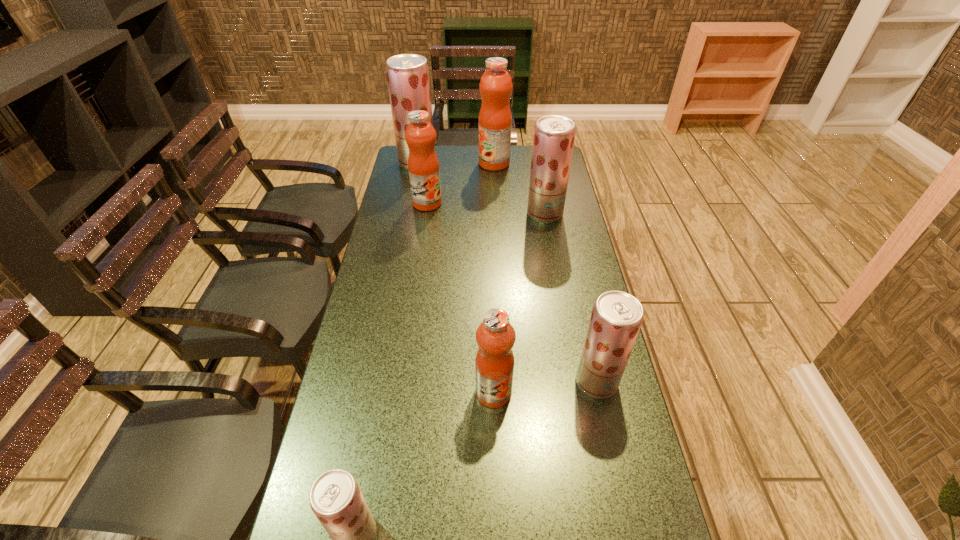
Choose which object is the second nearest neighbor to the second smallest strawberry fruit juice. Please provide its 2D coordinates. Your answer should be formatted as a tuple, i.e. [(x, y)], where the tuple contains the x and y coordinates of a point satisfying the conditions above.

[(335, 498)]

Find the location of a particular element. This screenshot has width=960, height=540. fruit juice that stands as the fourth closest to the biggest orange fruit juice is located at coordinates (616, 318).

Locate an element on the screen. The width and height of the screenshot is (960, 540). fruit juice that is the second closest to the smallest strawberry fruit juice is located at coordinates (616, 318).

Image resolution: width=960 pixels, height=540 pixels. What are the coordinates of `orange fruit juice that is the second nearest to the farthest orange fruit juice` in the screenshot? It's located at (495, 336).

The image size is (960, 540). Identify the location of orange fruit juice object that ranks as the closest to the leftmost orange fruit juice. (495, 119).

This screenshot has height=540, width=960. I want to click on strawberry fruit juice identified as the second closest to the biggest strawberry fruit juice, so click(x=616, y=318).

At what (x,y) coordinates should I click in order to perform the action: click on strawberry fruit juice that stands as the closest to the leftmost orange fruit juice. Please return your answer as a coordinate pair (x, y). Looking at the image, I should click on (408, 79).

At what (x,y) coordinates should I click in order to perform the action: click on vacant area in the image that satisfies the following two spatial constraints: 1. on the front label of the second nearest orange fruit juice; 2. on the left side of the second farthest strawberry fruit juice. Please return your answer as a coordinate pair (x, y). The height and width of the screenshot is (540, 960). Looking at the image, I should click on (425, 214).